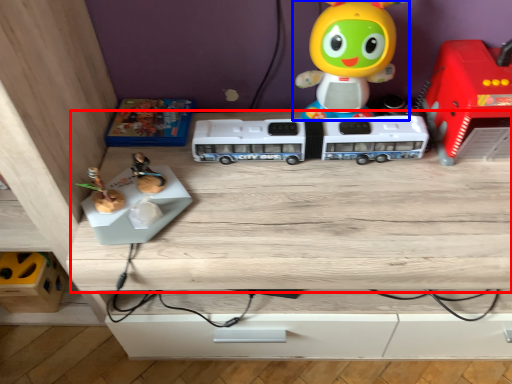
Question: Which object appears farthest to the camera in this image, table (highlighted by a red box) or toy (highlighted by a blue box)?

Choices:
 (A) table
 (B) toy

Answer: (B)